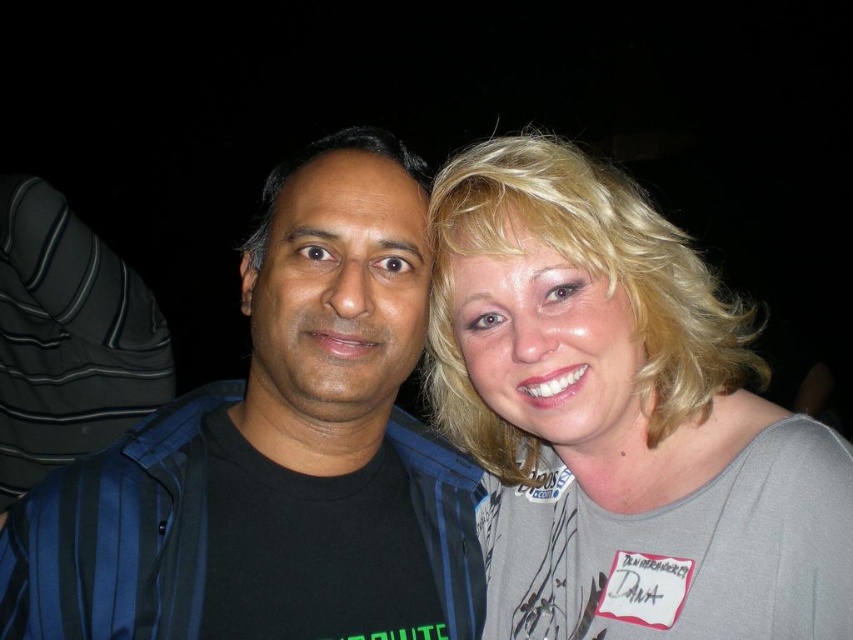
You are a photographer setting up for a group photo. You notice the gray fabric shirt at upper right and the black matte jacket at left in the frame. Which clothing item appears taller in the image?

The gray fabric shirt at upper right has a greater height compared to the black matte jacket at left, so it appears taller in the image.